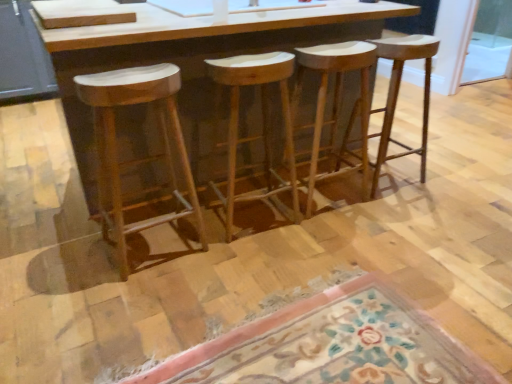
At what (x,y) coordinates should I click in order to perform the action: click on free spot in front of natural wood stool at center, the 2th stool in the right-to-left sequence. Please return your answer as a coordinate pair (x, y). Looking at the image, I should click on (333, 232).